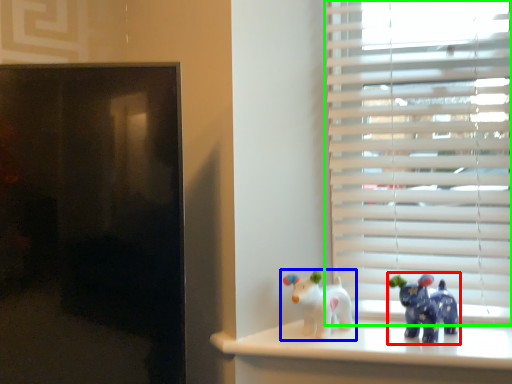
Question: Estimate the real-world distances between objects in this image. Which object is farther from toy (highlighted by a red box), toy (highlighted by a blue box) or window blind (highlighted by a green box)?

Choices:
 (A) toy
 (B) window blind

Answer: (B)